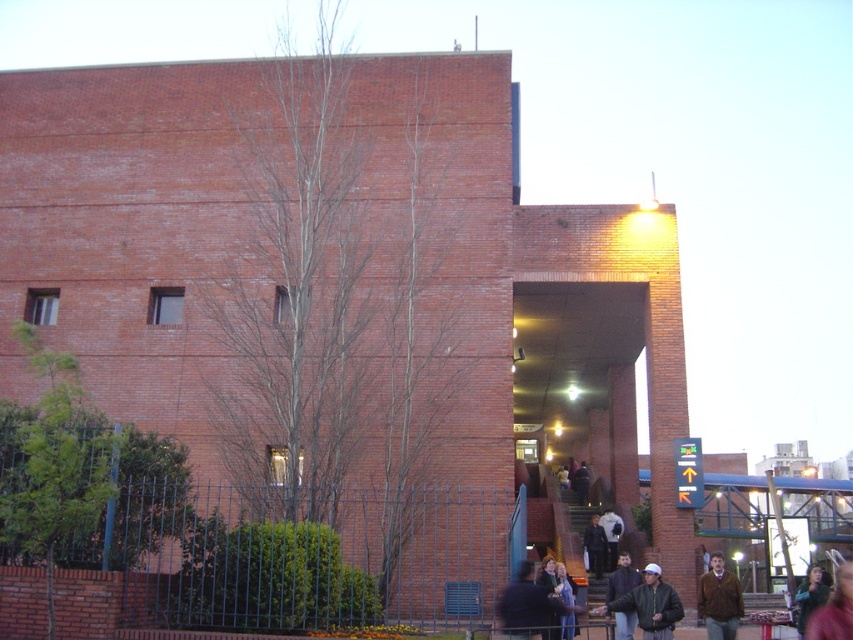
Which of these two, green fuzzy jacket at lower right or white matte jacket at lower center, stands shorter?

Standing shorter between the two is white matte jacket at lower center.

Is green fuzzy jacket at lower right behind white matte jacket at lower center?

No, green fuzzy jacket at lower right is closer to the viewer.

Between point (801, 586) and point (622, 525), which one is positioned behind?

The point (622, 525) is behind.

Identify the location of green fuzzy jacket at lower right. (811, 595).

Who is higher up, black leather jacket at lower center or dark brown leather jacket at lower right?

Positioned higher is black leather jacket at lower center.

Where is `black leather jacket at lower center`? The image size is (853, 640). black leather jacket at lower center is located at coordinates (651, 604).

Who is more distant from viewer, [635,611] or [828,630]?

The point [635,611] is more distant.

At what (x,y) coordinates should I click in order to perform the action: click on black leather jacket at lower center. Please return your answer as a coordinate pair (x, y). The width and height of the screenshot is (853, 640). Looking at the image, I should click on (651, 604).

Which of these two, brown leather jacket at lower right or white matte jacket at lower center, stands shorter?

With less height is brown leather jacket at lower right.

From the picture: Which of these two, brown leather jacket at lower right or white matte jacket at lower center, stands taller?

white matte jacket at lower center is taller.

Find the location of a particular element. brown leather jacket at lower right is located at coordinates (718, 600).